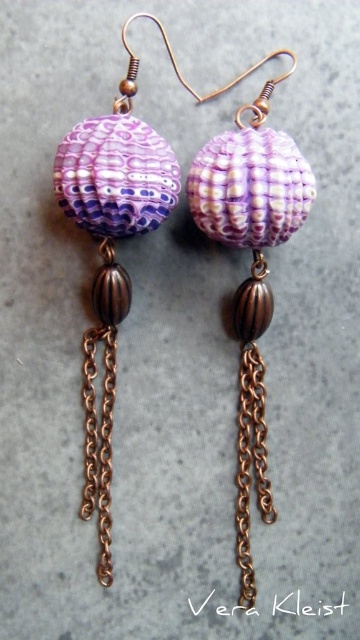
Is point (258, 406) farther from camera compared to point (101, 557)?

Yes.

Describe the element at coordinates (250, 465) in the screenshot. I see `copper chain at lower center` at that location.

Where is `copper chain at lower center`? The height and width of the screenshot is (640, 360). copper chain at lower center is located at coordinates (250, 465).

The height and width of the screenshot is (640, 360). I want to click on copper chain at lower center, so click(x=250, y=465).

Between point (115, 120) and point (249, 417), which one is positioned behind?

Positioned behind is point (249, 417).

Locate an element on the screen. matte purple shell at left is located at coordinates (111, 252).

Between point (109, 540) and point (90, 396), which one is positioned behind?

Positioned behind is point (90, 396).

Is matte purple shell at left to the left of copper chain at center from the viewer's perspective?

In fact, matte purple shell at left is to the right of copper chain at center.

At what (x,y) coordinates should I click in order to perform the action: click on matte purple shell at left. Please return your answer as a coordinate pair (x, y). Image resolution: width=360 pixels, height=640 pixels. Looking at the image, I should click on (111, 252).

Where is `matte purple shell at left`? matte purple shell at left is located at coordinates (111, 252).